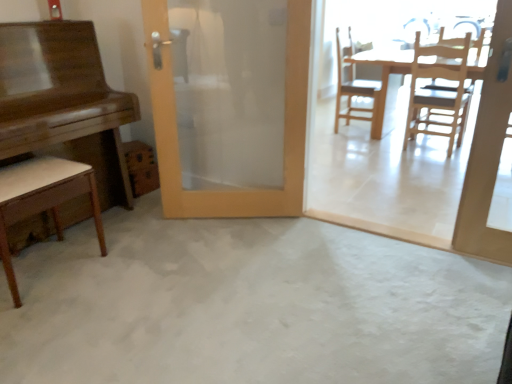
The image size is (512, 384). I want to click on vacant space underneath wooden door at center (from a real-world perspective), so click(224, 214).